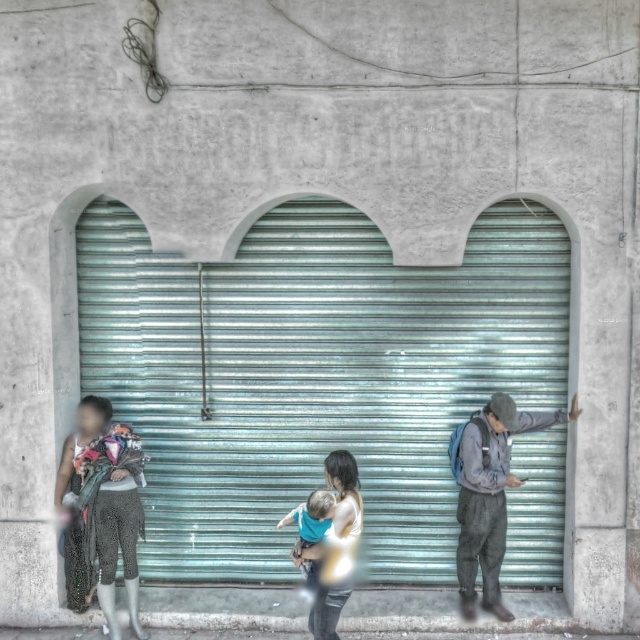
You are a photographer trying to capture a photo of the light blue fabric baby at center and the sparkly silver pants at left. To ensure both subjects are in the frame, should you adjust your camera to focus more to the left or to the right?

The sparkly silver pants at left is to the left of the light blue fabric baby at center, so you should adjust your camera to focus more to the left to include both subjects in the frame.

You are a tailor who needs to determine which item takes up more horizontal space between the gray fabric jacket at right and the light blue fabric baby at center. Which one is wider?

The gray fabric jacket at right is wider than the light blue fabric baby at center.

You are a delivery person carrying a package that measures 36 inches in length. You need to pass between the gray fabric jacket at right and the light blue fabric baby at center. Can you fit through the space without bending or tilting the package?

The distance between the gray fabric jacket at right and the light blue fabric baby at center is 35.83 inches. Since the package is 36 inches long, it is slightly too long to fit through the space without bending or tilting.